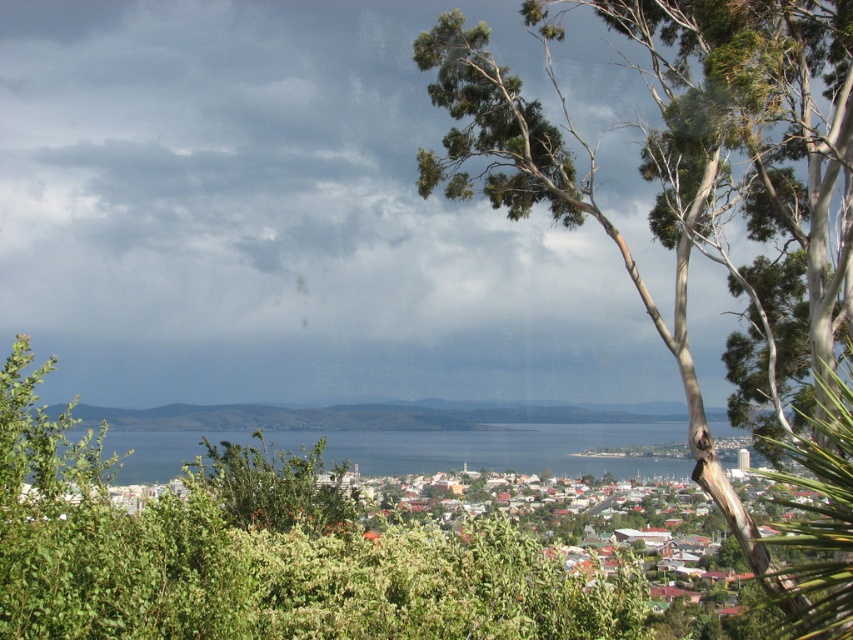
You are an environmental researcher studying the coastal town. You observe the green textured tree at upper right and the green leafy bush at center. Which of these two plants is located to the right of the other?

The green textured tree at upper right is positioned on the right side of the green leafy bush at center.

You are an architect planning to build a new observation deck in the coastal town. The deck must be positioned such that it faces away from the green textured tree at upper right. Based on the scene description, in which general direction should the observation deck be oriented?

The green textured tree at upper right is located at point (703, 209). Since the tree is at the upper right, the observation deck should be oriented towards the lower left direction to face away from it.